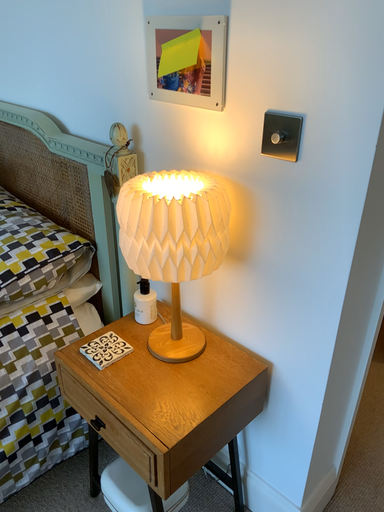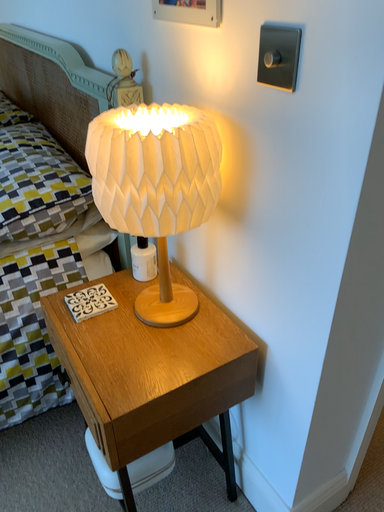
Question: How did the camera likely rotate when shooting the video?

Choices:
 (A) rotated right
 (B) rotated left

Answer: (B)